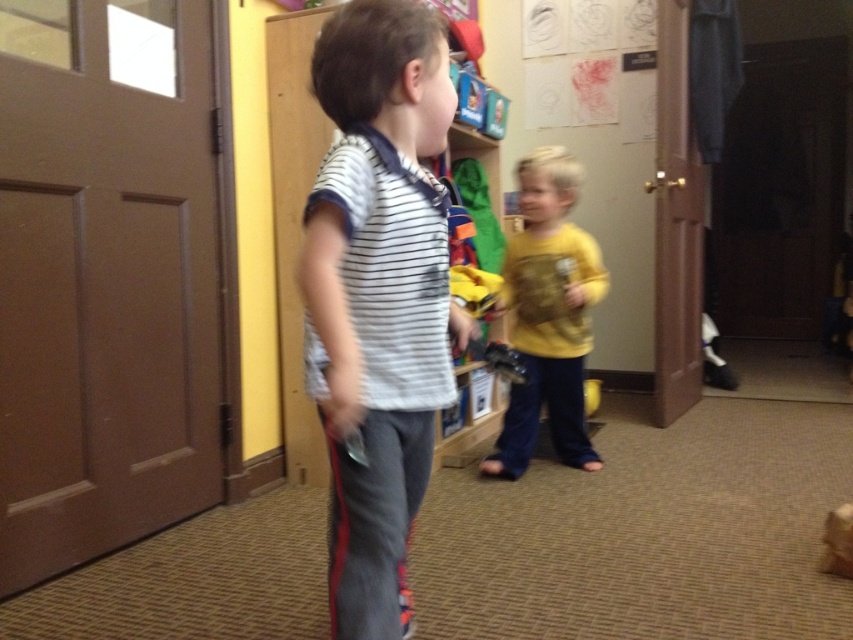
Does white striped shirt at center appear on the left side of yellow matte shirt at center?

Indeed, white striped shirt at center is positioned on the left side of yellow matte shirt at center.

This screenshot has height=640, width=853. What do you see at coordinates (378, 296) in the screenshot? I see `white striped shirt at center` at bounding box center [378, 296].

Who is more distant from viewer, (381,492) or (566,330)?

The point (566,330) is behind.

The width and height of the screenshot is (853, 640). I want to click on white striped shirt at center, so click(x=378, y=296).